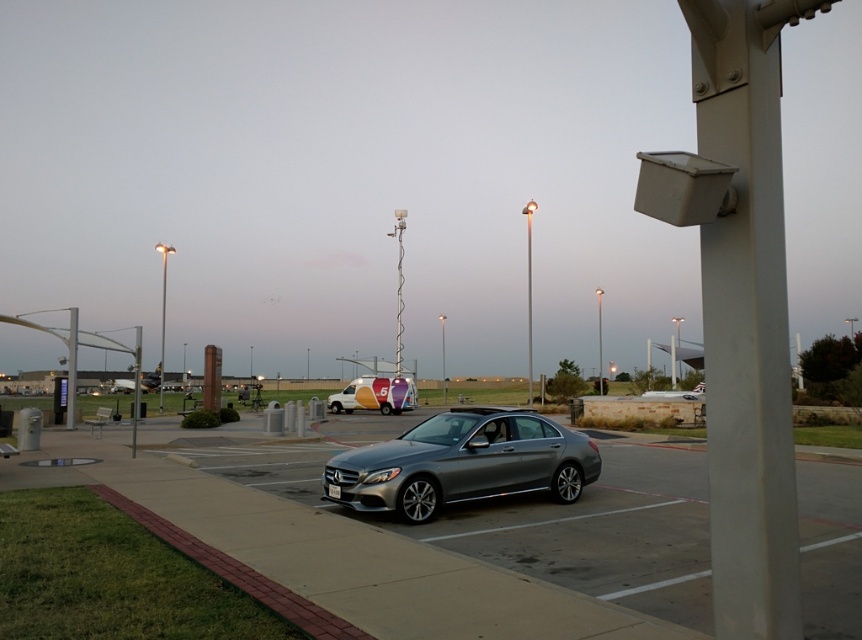
Is brick at lower left positioned before brushed metal pole at left?

Yes.

Between point (266, 582) and point (73, 344), which one is positioned in front?

Point (266, 582) is more forward.

Identify the location of brick at lower left. (238, 573).

Is gray asphalt pavement at lower center thinner than satin silver sedan at center?

No.

Is point (848, 536) positioned before point (504, 470)?

Yes, point (848, 536) is in front of point (504, 470).

Locate an element on the screen. This screenshot has height=640, width=862. gray asphalt pavement at lower center is located at coordinates (523, 513).

Is satin silver sedan at center shorter than metallic silver van at center?

In fact, satin silver sedan at center may be taller than metallic silver van at center.

What do you see at coordinates (461, 461) in the screenshot?
I see `satin silver sedan at center` at bounding box center [461, 461].

Where is `satin silver sedan at center`? satin silver sedan at center is located at coordinates (461, 461).